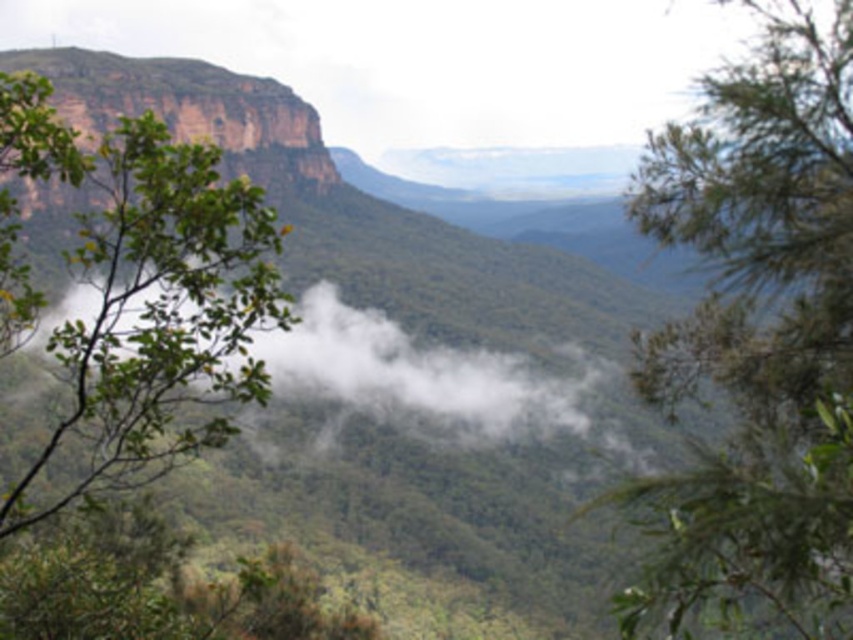
Question: Which of these objects is positioned closest to the green leafy tree at upper left?

Choices:
 (A) white fluffy cloud at center
 (B) green leafy tree at left

Answer: (B)

Question: Is green leafy tree at upper left positioned in front of white fluffy cloud at center?

Choices:
 (A) no
 (B) yes

Answer: (B)

Question: Can you confirm if green leafy tree at upper left is bigger than green leafy tree at left?

Choices:
 (A) yes
 (B) no

Answer: (B)

Question: Which point is farther from the camera taking this photo?

Choices:
 (A) (109, 429)
 (B) (654, 202)
 (C) (383, 328)

Answer: (C)

Question: Estimate the real-world distances between objects in this image. Which object is farther from the green leafy tree at left?

Choices:
 (A) green leafy tree at upper left
 (B) white fluffy cloud at center

Answer: (A)

Question: Is green leafy tree at upper left to the left of green leafy tree at left from the viewer's perspective?

Choices:
 (A) yes
 (B) no

Answer: (B)